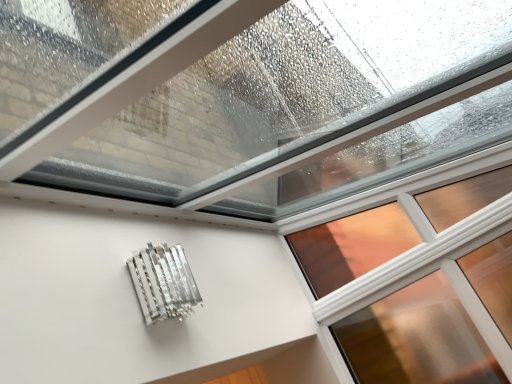
The width and height of the screenshot is (512, 384). Describe the element at coordinates (163, 283) in the screenshot. I see `metallic silver at lower left` at that location.

The width and height of the screenshot is (512, 384). What are the coordinates of `metallic silver at lower left` in the screenshot? It's located at (163, 283).

Looking at this image, what is the approximate width of clear glass window at upper center?

clear glass window at upper center is 8.06 centimeters wide.

Image resolution: width=512 pixels, height=384 pixels. What do you see at coordinates (416, 338) in the screenshot? I see `clear glass window at upper center` at bounding box center [416, 338].

Find the location of a particular element. clear glass window at upper center is located at coordinates (416, 338).

I want to click on metallic silver at lower left, so click(163, 283).

Which object is positioned more to the right, metallic silver at lower left or clear glass window at upper center?

From the viewer's perspective, clear glass window at upper center appears more on the right side.

Considering their positions, is metallic silver at lower left located in front of or behind clear glass window at upper center?

metallic silver at lower left is in front of clear glass window at upper center.

Is point (141, 297) farther from viewer compared to point (416, 236)?

No, it is not.

From the image's perspective, which one is positioned higher, metallic silver at lower left or clear glass window at upper center?

clear glass window at upper center is shown above in the image.

From a real-world perspective, who is located higher, metallic silver at lower left or clear glass window at upper center?

In real-world perspective, metallic silver at lower left is above.

Considering the relative sizes of metallic silver at lower left and clear glass window at upper center in the image provided, is metallic silver at lower left thinner than clear glass window at upper center?

No.

Is metallic silver at lower left shorter than clear glass window at upper center?

Yes.

Considering the sizes of objects metallic silver at lower left and clear glass window at upper center in the image provided, who is smaller, metallic silver at lower left or clear glass window at upper center?

metallic silver at lower left.

Looking at this image, can clear glass window at upper center be found inside metallic silver at lower left?

Definitely not — clear glass window at upper center is not inside metallic silver at lower left.

Is metallic silver at lower left far away from clear glass window at upper center?

That's not correct — metallic silver at lower left is a little close to clear glass window at upper center.

Is metallic silver at lower left facing away from clear glass window at upper center?

That's not correct — metallic silver at lower left is not looking away from clear glass window at upper center.

What's the angular difference between metallic silver at lower left and clear glass window at upper center's facing directions?

They differ by 90.5 degrees in their facing directions.

Find the location of a particular element. metal on the left of clear glass window at upper center is located at coordinates click(163, 283).

Is clear glass window at upper center at the left side of metallic silver at lower left?

No, clear glass window at upper center is not to the left of metallic silver at lower left.

Who is more distant, clear glass window at upper center or metallic silver at lower left?

clear glass window at upper center is further from the camera.

Does point (426, 308) come in front of point (184, 270)?

No, (426, 308) is behind (184, 270).

From the image's perspective, would you say clear glass window at upper center is shown under metallic silver at lower left?

No, from the image's perspective, clear glass window at upper center is not beneath metallic silver at lower left.

From a real-world perspective, who is located lower, clear glass window at upper center or metallic silver at lower left?

In real-world perspective, clear glass window at upper center is lower.

In the scene shown: Considering the sizes of objects clear glass window at upper center and metallic silver at lower left in the image provided, who is wider, clear glass window at upper center or metallic silver at lower left?

metallic silver at lower left.

Is clear glass window at upper center shorter than metallic silver at lower left?

In fact, clear glass window at upper center may be taller than metallic silver at lower left.

Is clear glass window at upper center bigger than metallic silver at lower left?

Indeed, clear glass window at upper center has a larger size compared to metallic silver at lower left.

Could metallic silver at lower left be considered to be inside clear glass window at upper center?

Definitely not — metallic silver at lower left is not inside clear glass window at upper center.

Would you consider clear glass window at upper center to be distant from metallic silver at lower left?

That's not correct — clear glass window at upper center is a little close to metallic silver at lower left.

Could you tell me if clear glass window at upper center is turned towards metallic silver at lower left?

Yes, clear glass window at upper center faces towards metallic silver at lower left.

How far apart are clear glass window at upper center and metallic silver at lower left?

clear glass window at upper center is 38.94 inches from metallic silver at lower left.

Find the location of a particular element. metal on the left of clear glass window at upper center is located at coordinates (163, 283).

Where is `metal on the left of clear glass window at upper center`? This screenshot has width=512, height=384. metal on the left of clear glass window at upper center is located at coordinates (163, 283).

Where is `window on the right of metallic silver at lower left`? window on the right of metallic silver at lower left is located at coordinates (416, 338).